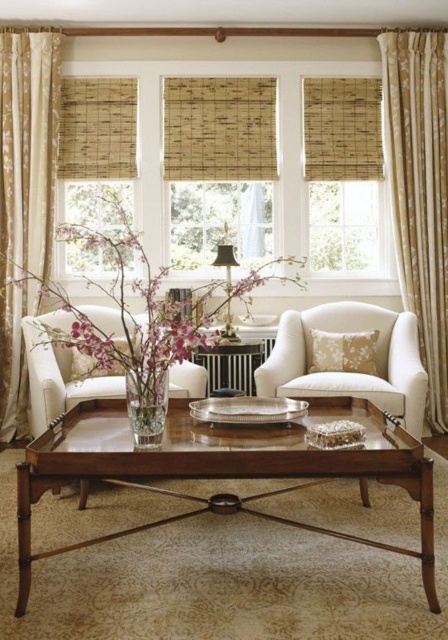
Question: Is floral-patterned fabric cushion at center-right above white floral-patterned pillow at center?

Choices:
 (A) no
 (B) yes

Answer: (A)

Question: Does bamboo blind at center come in front of bamboo blind at upper center?

Choices:
 (A) no
 (B) yes

Answer: (B)

Question: Which object is closer to the camera taking this photo?

Choices:
 (A) white fabric armchair at center
 (B) metallic radiator at center

Answer: (A)

Question: Which of the following is the closest to the observer?

Choices:
 (A) white floral-patterned pillow at center
 (B) clear glass vase at center

Answer: (B)

Question: Can you confirm if bamboo blind at center is positioned to the right of bamboo blind at upper center?

Choices:
 (A) yes
 (B) no

Answer: (B)

Question: Which object is positioned closest to the bamboo blind at center?

Choices:
 (A) bamboo blinds at center
 (B) mahogany wood coffee table at center
 (C) beige textured curtain at left

Answer: (A)